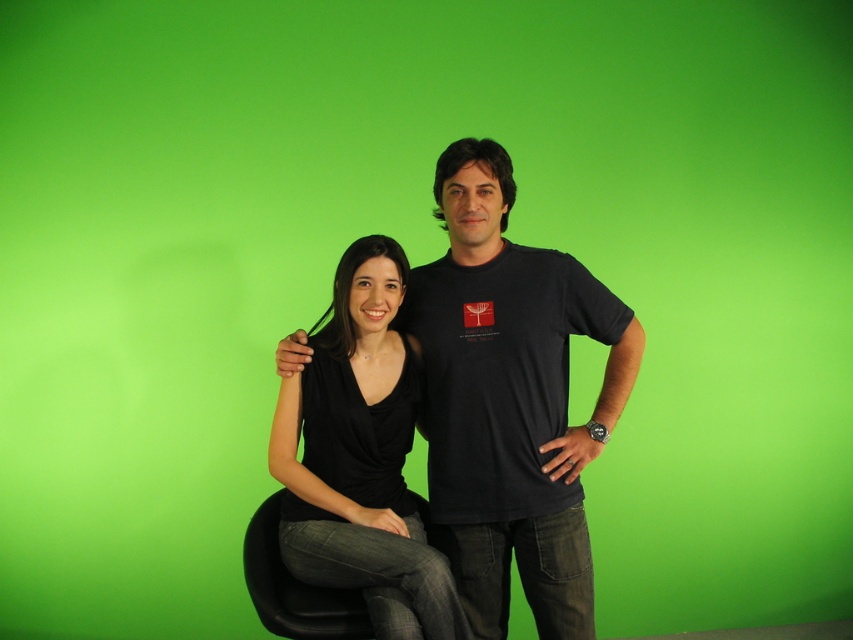
Is black matte t-shirt at center taller than black matte shirt at center?

Yes.

Is point (631, 340) positioned after point (328, 410)?

Yes, it is.

What do you see at coordinates (509, 400) in the screenshot?
I see `black matte t-shirt at center` at bounding box center [509, 400].

This screenshot has width=853, height=640. I want to click on black matte t-shirt at center, so click(509, 400).